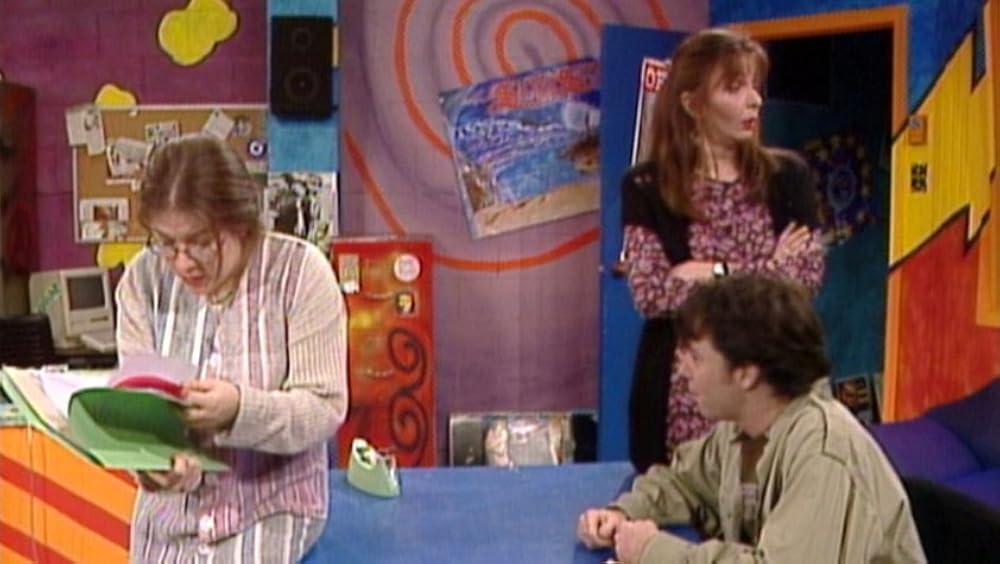
Locate an element on the screen. tape dispenser is located at coordinates (360, 473).